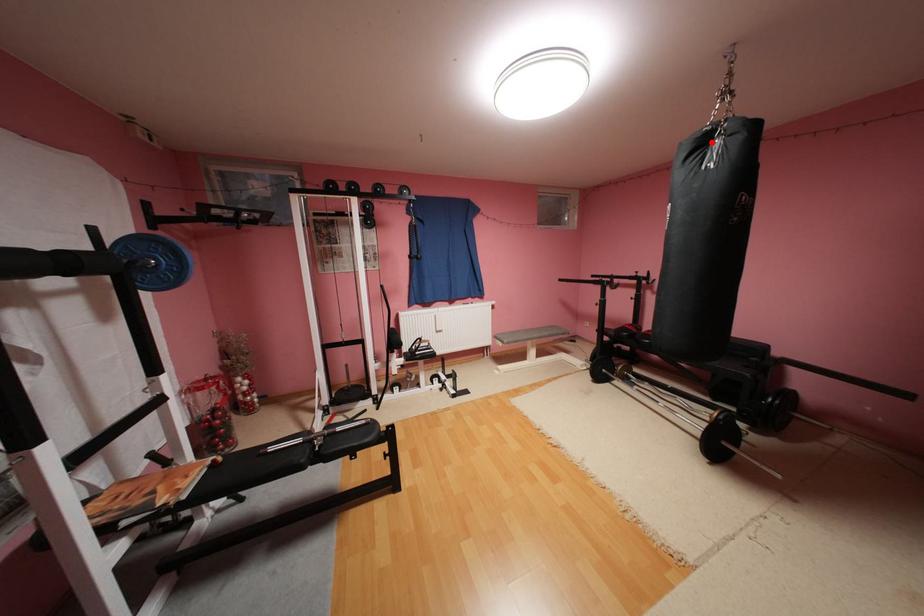
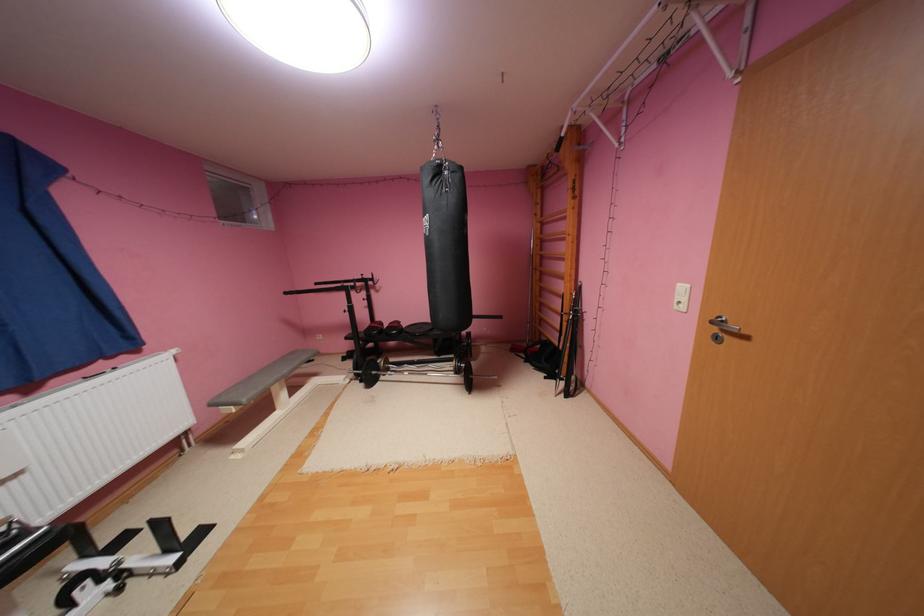
Find the pixel in the second image that matches the highlighted location in the first image.

(446, 171)